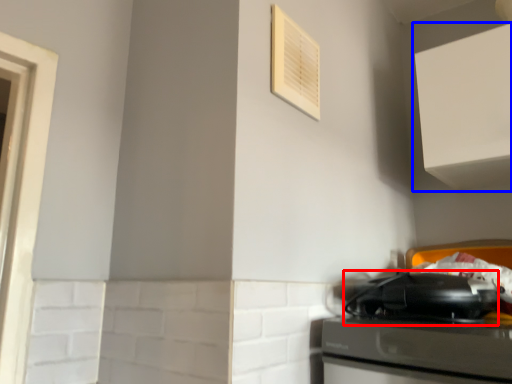
Question: Which point is further to the camera, appliance (highlighted by a red box) or cabinetry (highlighted by a blue box)?

Choices:
 (A) appliance
 (B) cabinetry

Answer: (B)